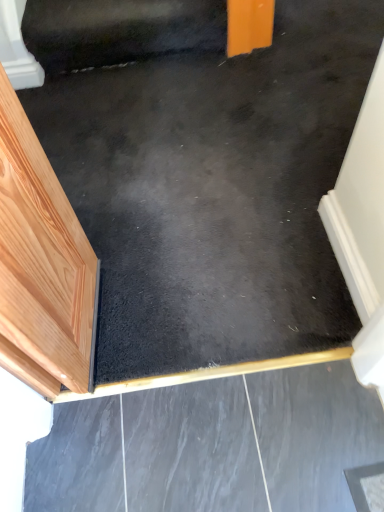
This screenshot has width=384, height=512. In order to click on black carpet at upper left in this screenshot , I will do `click(119, 31)`.

This screenshot has height=512, width=384. What do you see at coordinates (119, 31) in the screenshot?
I see `black carpet at upper left` at bounding box center [119, 31].

Image resolution: width=384 pixels, height=512 pixels. In order to click on black carpet at upper left in this screenshot , I will do `click(119, 31)`.